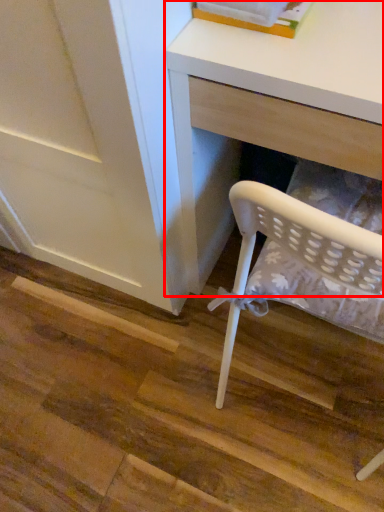
Question: In this image, where is desk (annotated by the red box) located relative to book?

Choices:
 (A) right
 (B) left

Answer: (A)